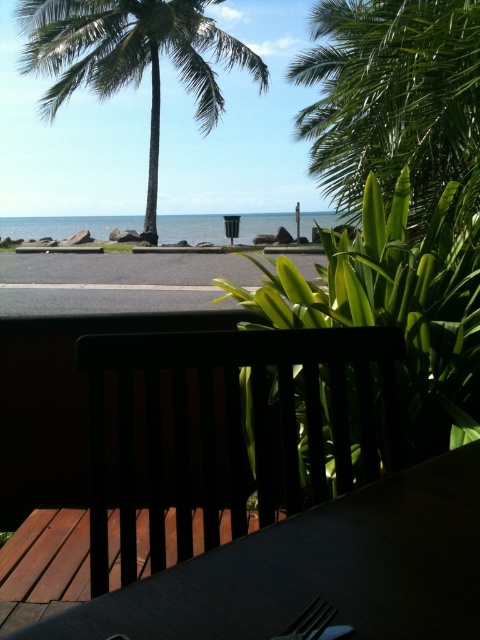
Question: Can you confirm if matte black bench at center is smaller than green leafy palm tree at upper right?

Choices:
 (A) yes
 (B) no

Answer: (A)

Question: Which of the following is the farthest from the observer?

Choices:
 (A) matte black bench at center
 (B) dark wood table at center
 (C) clear blue water at center
 (D) metallic silverware at lower center

Answer: (C)

Question: Is matte black bench at center wider than dark wood table at center?

Choices:
 (A) no
 (B) yes

Answer: (B)

Question: Which of the following is the farthest from the observer?

Choices:
 (A) (443, 3)
 (B) (55, 228)
 (C) (136, 605)

Answer: (B)

Question: Does dark wood table at center have a smaller size compared to green leafy palm tree at upper right?

Choices:
 (A) no
 (B) yes

Answer: (B)

Question: Which object is closer to the camera taking this photo?

Choices:
 (A) green leafy palm tree at upper right
 (B) green leafy palm tree at upper left

Answer: (A)